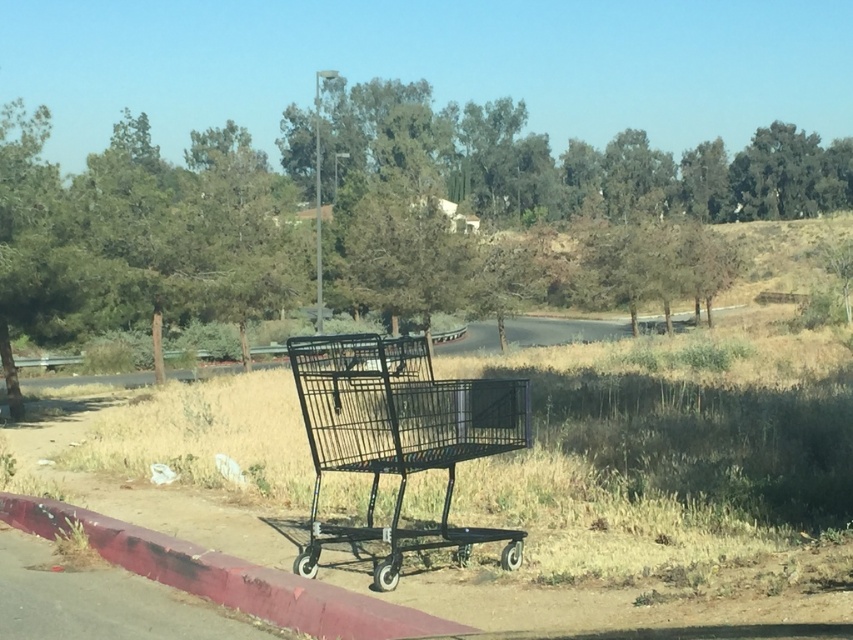
Consider the image. Between black wire shopping cart at center and smooth concrete curb at lower left, which one is positioned lower?

smooth concrete curb at lower left

Which is more to the right, black wire shopping cart at center or smooth concrete curb at lower left?

Positioned to the right is black wire shopping cart at center.

Is point (512, 532) positioned in front of point (393, 616)?

No, (512, 532) is behind (393, 616).

Where is `black wire shopping cart at center`? The width and height of the screenshot is (853, 640). black wire shopping cart at center is located at coordinates [x=399, y=436].